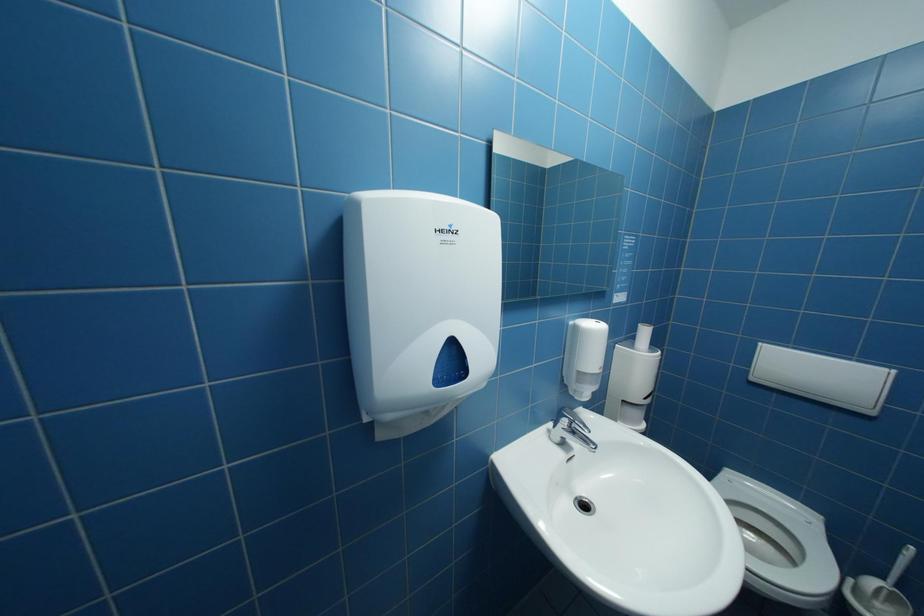
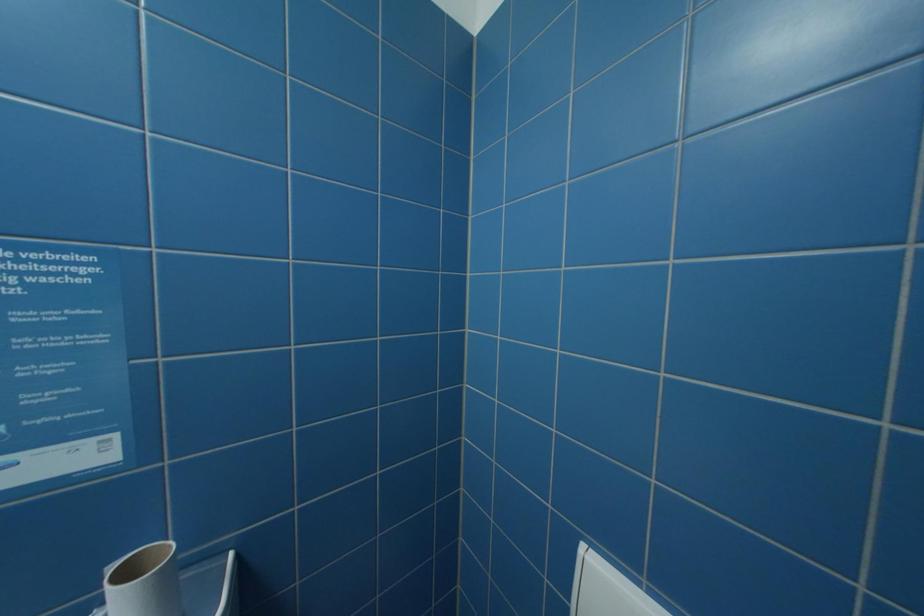
The images are taken continuously from a first-person perspective. In which direction are you moving?

The cameraman walked toward right, forward.